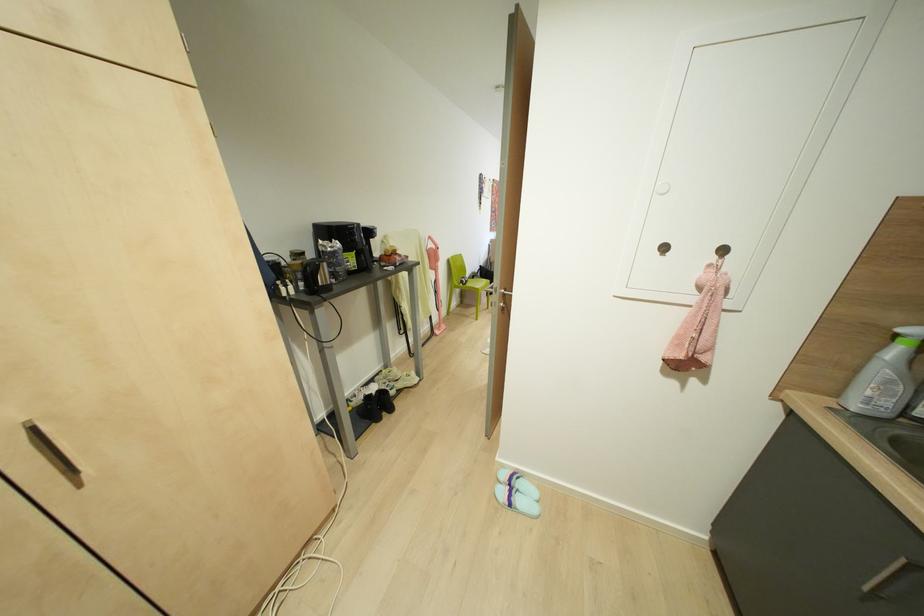
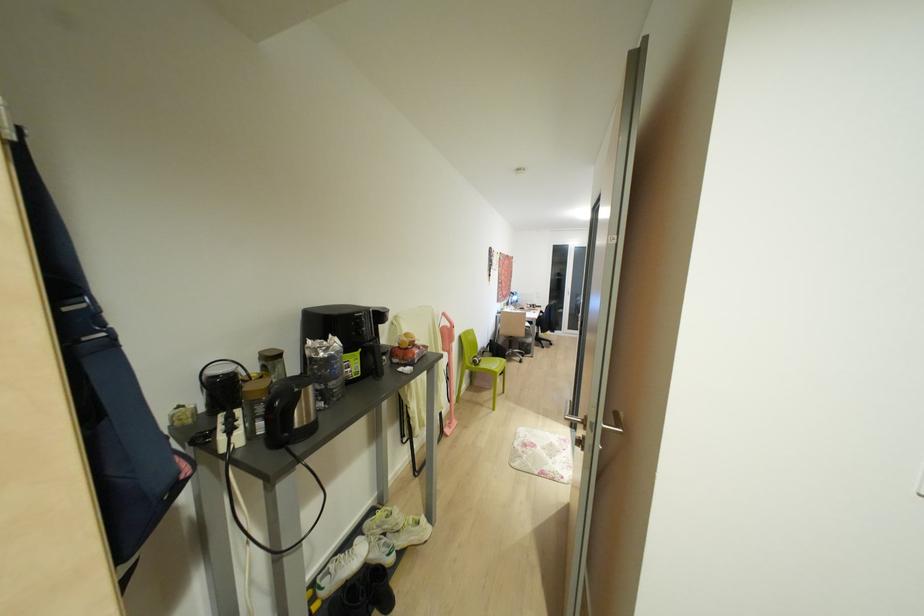
Question: The first image is from the beginning of the video and the second image is from the end. How did the camera likely rotate when shooting the video?

Choices:
 (A) Left
 (B) Right
 (C) Up
 (D) Down

Answer: (C)